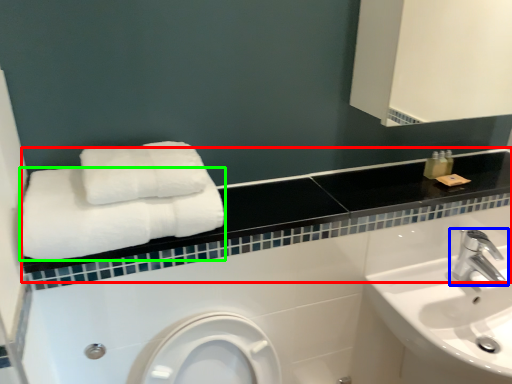
Question: Which object is positioned closest to balustrade (highlighted by a red box)? Select from tap (highlighted by a blue box) and towel (highlighted by a green box).

Choices:
 (A) tap
 (B) towel

Answer: (B)